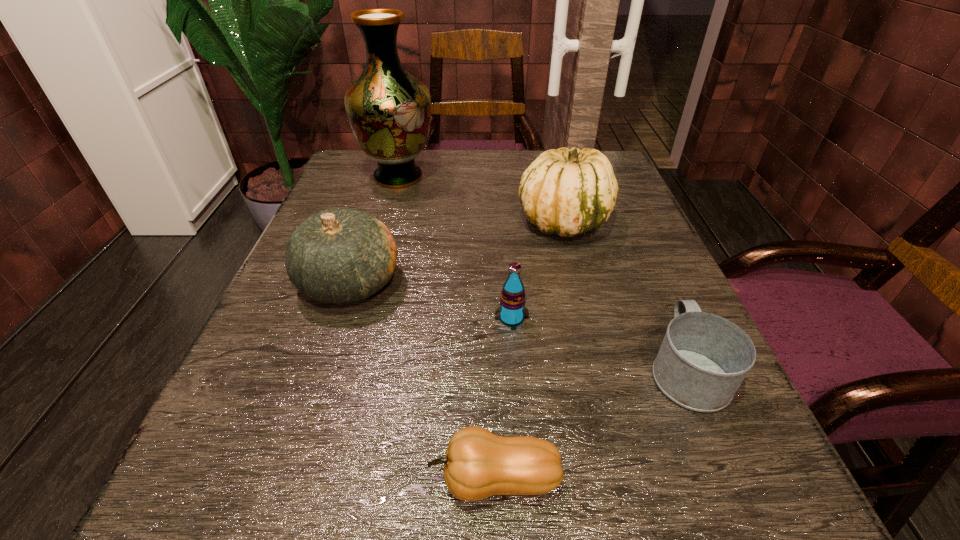
What are the coordinates of `vase located at the left edge` in the screenshot? It's located at (389, 110).

Image resolution: width=960 pixels, height=540 pixels. Find the location of `gourd that is at the left edge`. gourd that is at the left edge is located at coordinates (340, 256).

Image resolution: width=960 pixels, height=540 pixels. Find the location of `gourd at the right edge`. gourd at the right edge is located at coordinates (567, 192).

Image resolution: width=960 pixels, height=540 pixels. Find the location of `mug that is at the right edge`. mug that is at the right edge is located at coordinates (703, 359).

The image size is (960, 540). Identify the location of object located in the far left corner section of the desktop. (389, 110).

Identify the location of object present at the far right corner. (567, 192).

You are a GUI agent. You are given a task and a screenshot of the screen. Output one action in this format:
    pyautogui.click(x=<x>, y=<y>)
    Task: Click on the free space at the far edge
    The image size is (960, 540).
    Given the screenshot: What is the action you would take?
    pos(498,190)

Where is `blank space at the near edge`? This screenshot has width=960, height=540. blank space at the near edge is located at coordinates (442, 534).

In the image, there is a desktop. At what (x,y) coordinates should I click in order to perform the action: click on vacant space at the left edge. Please return your answer as a coordinate pair (x, y). Looking at the image, I should click on (340, 320).

The height and width of the screenshot is (540, 960). I want to click on vacant position at the far left corner of the desktop, so click(352, 151).